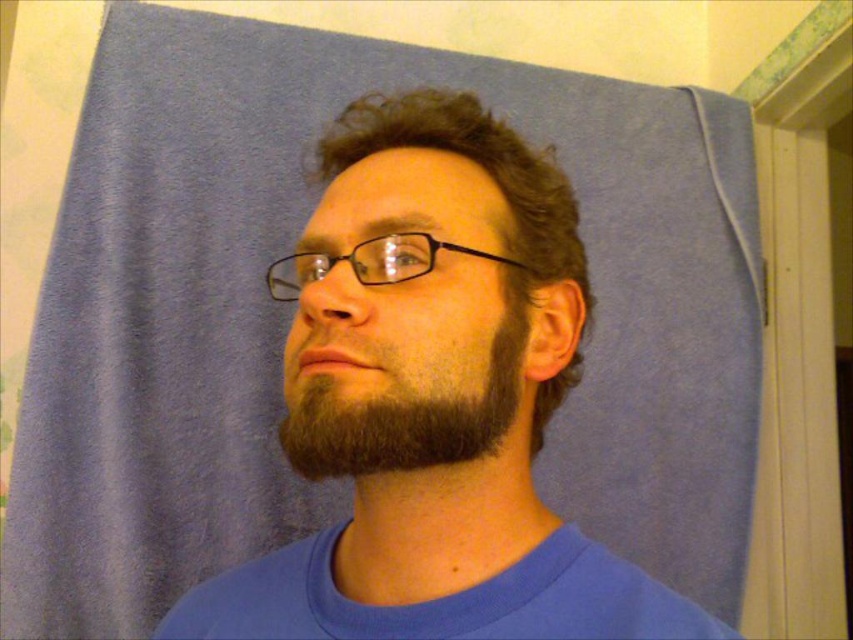
You are holding a 12 inch ruler and want to measure the distance between you and the point at coordinates point (369, 497). Can you reach it without moving your hand?

The point point (369, 497) is 17.47 inches away from you, so you cannot reach it with a 12 inch ruler without moving your hand.

You are a photographer adjusting the lighting for a portrait. You notice the blue matte shirt at center and the dark brown fuzzy beard at center in the frame. Which object is positioned more to the left in the image?

The blue matte shirt at center is positioned to the left of the dark brown fuzzy beard at center, so it is more to the left.

You are designing a headband that needs to fit around the dark brown curly hair at center and also accommodate the black plastic glasses at center. Based on the image, which object requires a wider headband to fit comfortably?

The dark brown curly hair at center requires a wider headband because its width is larger than the black plastic glasses at center.